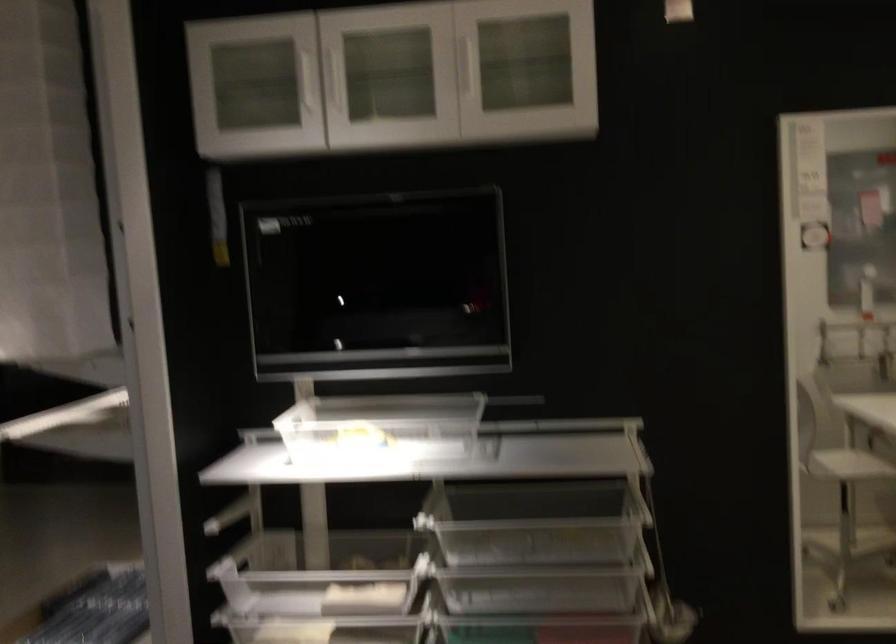
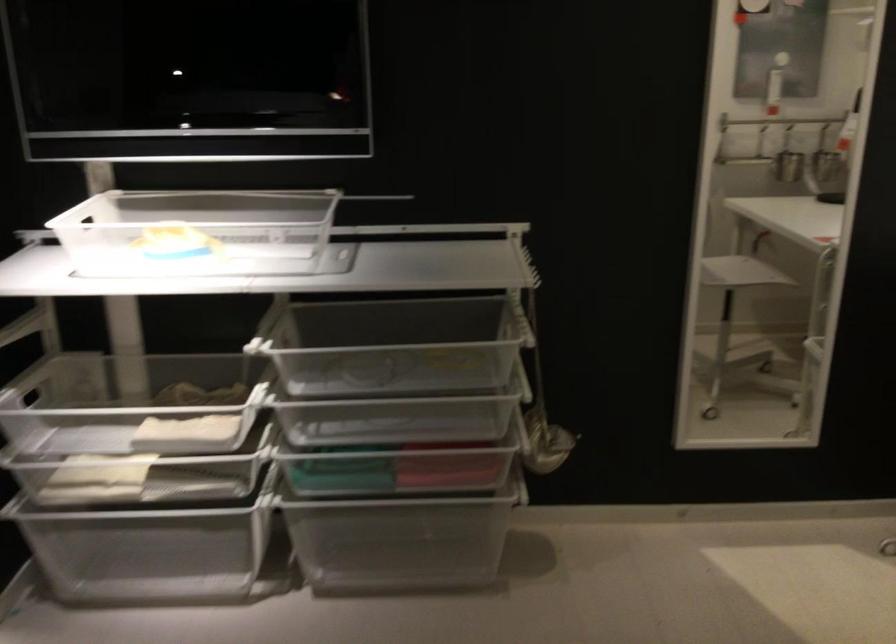
The point at (x=375, y=431) is marked in the first image. Where is the corresponding point in the second image?

(197, 232)